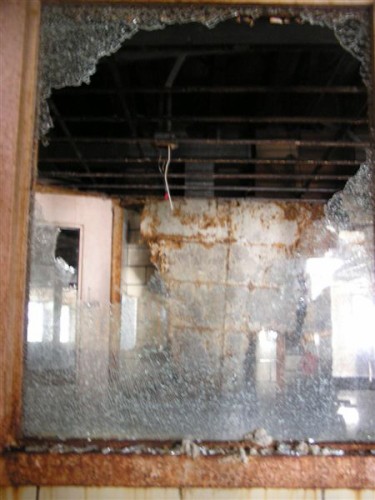
Find the location of a particular element. The width and height of the screenshot is (375, 500). broken glass on window seal is located at coordinates (37, 453), (56, 453), (184, 452), (139, 449), (306, 450).